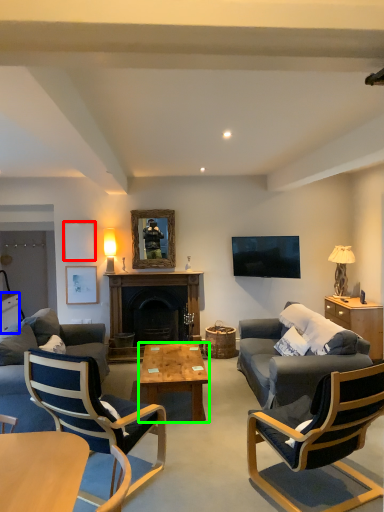
Question: Which object is positioned closest to picture frame (highlighted by a red box)? Select from cabinetry (highlighted by a blue box) and coffee table (highlighted by a green box).

Choices:
 (A) cabinetry
 (B) coffee table

Answer: (A)